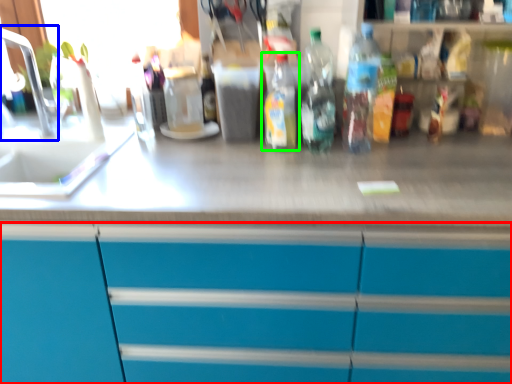
Question: Which object is the closest to the cabinetry (highlighted by a red box)? Choose among these: faucet (highlighted by a blue box) or bottle (highlighted by a green box).

Choices:
 (A) faucet
 (B) bottle

Answer: (B)